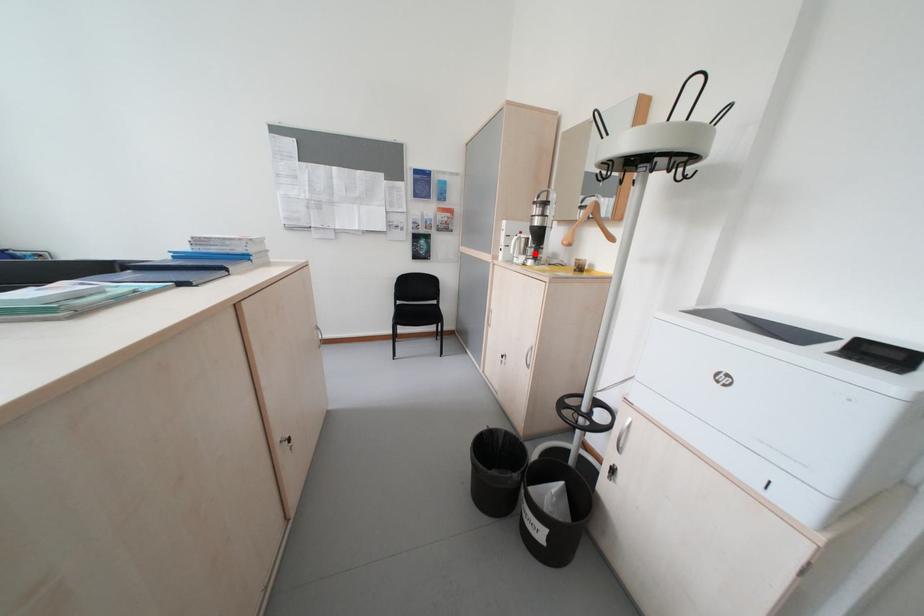
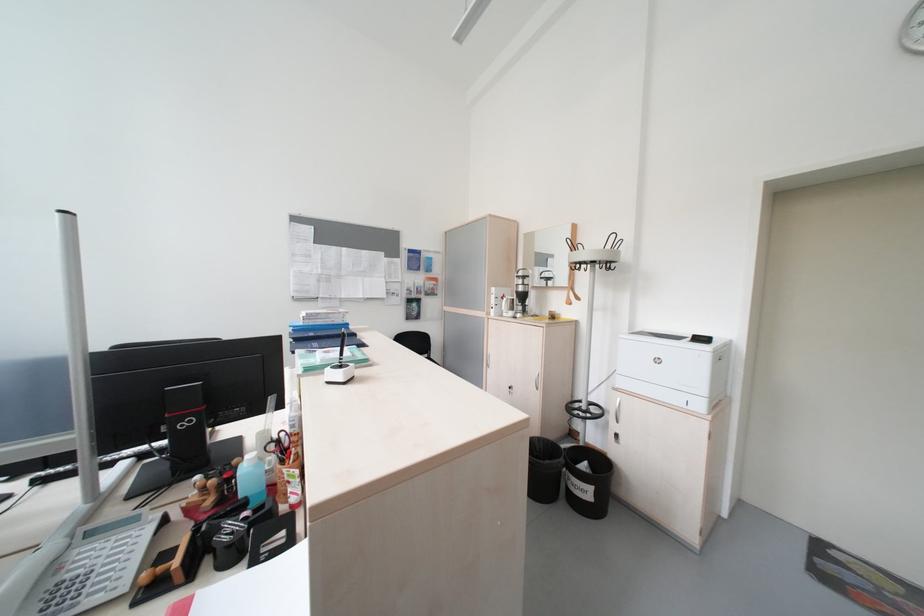
Locate, in the second image, the point that corresponds to the highlighted location in the first image.

(523, 310)